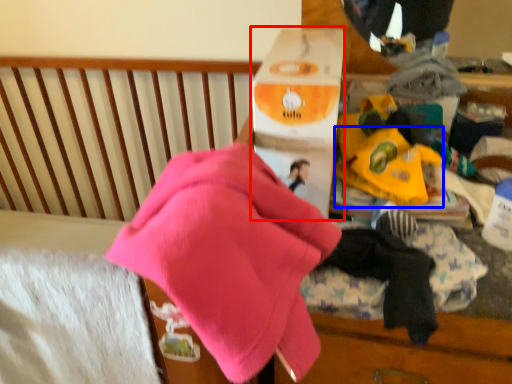
Question: Which object is closer to the camera taking this photo, cardboard box (highlighted by a red box) or toy (highlighted by a blue box)?

Choices:
 (A) cardboard box
 (B) toy

Answer: (A)